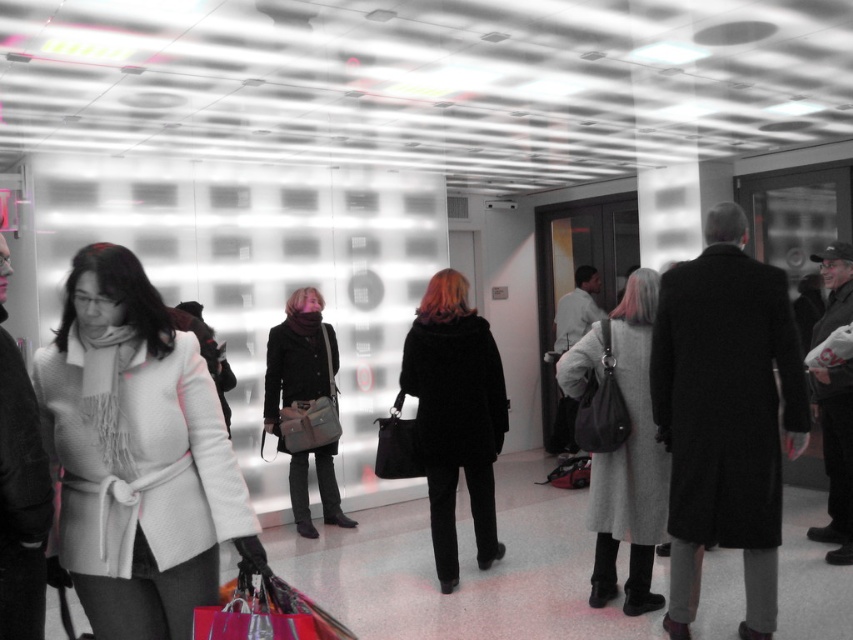
You are a store manager checking inventory and notice two coats displayed at the center of the store. The black fur coat at center and the matte black coat at center. Which coat has a larger width?

The black fur coat at center has a larger width than the matte black coat at center.

You are a photographer standing in the scene and want to take a picture of both the black fur coat at center and the matte black coat at center. Which coat should you adjust your camera angle to focus on first to ensure both are in the frame?

The black fur coat at center is in front of the matte black coat at center, so you should focus on the matte black coat at center first to ensure both are visible in the frame.

You are a store manager organizing a display in the center of the store. You have two coats to place on a single rack. The gray wool coat at center and the black fur coat at center. Which coat should you place on the lower hanger to ensure both coats are visible?

The gray wool coat at center is shorter than the black fur coat at center. To ensure both are visible, place the shorter gray wool coat at center on the lower hanger so its bottom doesn